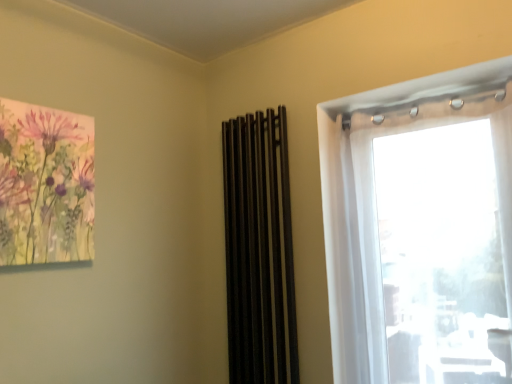
Question: Is black matte curtain at center to the left of transparent fabric at right from the viewer's perspective?

Choices:
 (A) yes
 (B) no

Answer: (A)

Question: Are black matte curtain at center and transparent fabric at right making contact?

Choices:
 (A) yes
 (B) no

Answer: (B)

Question: Is black matte curtain at center wider than transparent fabric at right?

Choices:
 (A) yes
 (B) no

Answer: (B)

Question: From the image's perspective, is black matte curtain at center beneath transparent fabric at right?

Choices:
 (A) no
 (B) yes

Answer: (B)

Question: Does black matte curtain at center have a lesser height compared to transparent fabric at right?

Choices:
 (A) yes
 (B) no

Answer: (B)

Question: Does black matte curtain at center come behind transparent fabric at right?

Choices:
 (A) yes
 (B) no

Answer: (A)

Question: From the image's perspective, is transparent fabric at right on top of black matte curtain at center?

Choices:
 (A) no
 (B) yes

Answer: (B)

Question: Is transparent fabric at right thinner than black matte curtain at center?

Choices:
 (A) yes
 (B) no

Answer: (B)

Question: Is transparent fabric at right at the left side of black matte curtain at center?

Choices:
 (A) yes
 (B) no

Answer: (B)

Question: Would you say transparent fabric at right is a long distance from black matte curtain at center?

Choices:
 (A) no
 (B) yes

Answer: (A)

Question: Is transparent fabric at right oriented away from black matte curtain at center?

Choices:
 (A) yes
 (B) no

Answer: (B)

Question: Is transparent fabric at right shorter than black matte curtain at center?

Choices:
 (A) no
 (B) yes

Answer: (B)

Question: Is black matte curtain at center taller or shorter than transparent fabric at right?

Choices:
 (A) tall
 (B) short

Answer: (A)